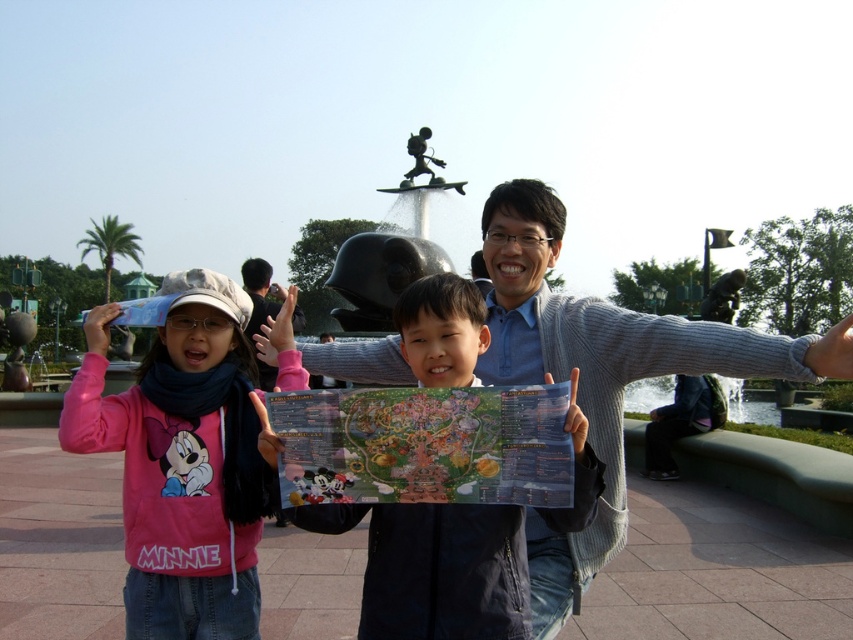
Based on the photo, you are a photographer trying to capture a photo of the gray knitted sweater at center and the multicolored paper map at center. Which object should you focus on first to ensure it appears larger in the photo?

The gray knitted sweater at center is much taller than the multicolored paper map at center, so you should focus on the gray knitted sweater at center first to ensure it appears larger in the photo.

You are a tour guide leading a group through the park. You need to hand out maps to visitors. Where should you place the multicolored paper map at center so that it is easily accessible to everyone standing near the black glossy water at center?

Place the multicolored paper map at center to the right of the black glossy water at center so it is within reach for visitors standing there.